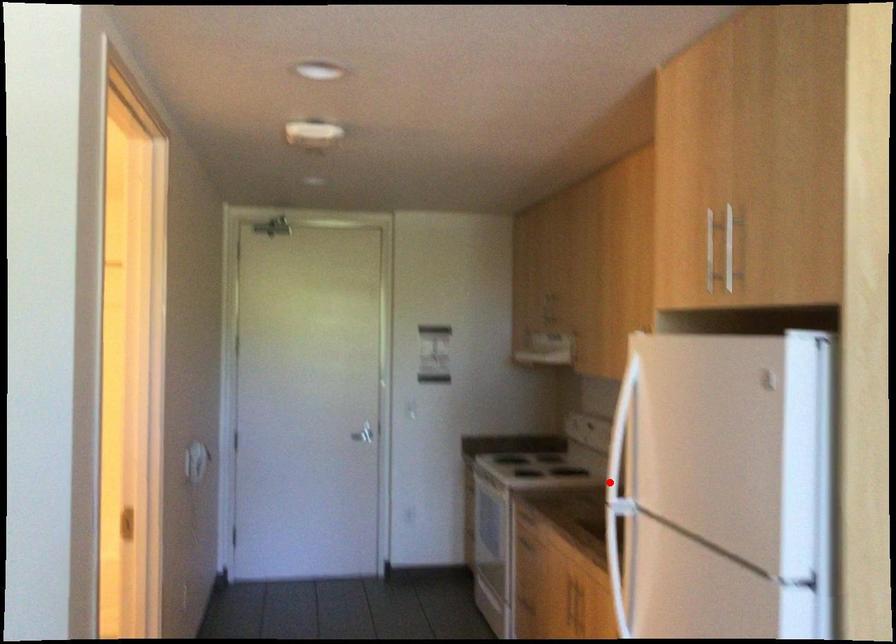
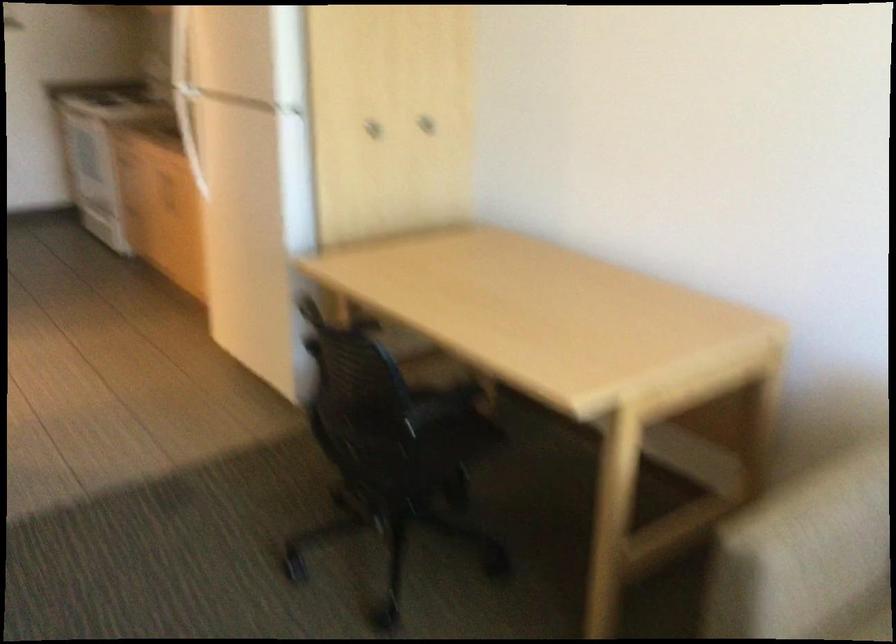
Find the pixel in the second image that matches the highlighted location in the first image.

(185, 93)